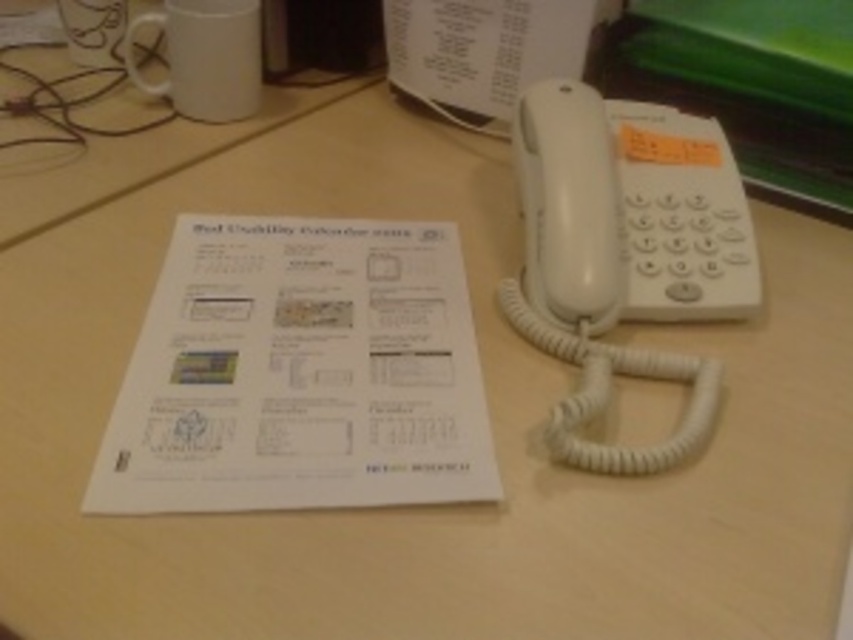
Can you confirm if white paper at center is thinner than white plastic phone at right?

No.

Between point (235, 438) and point (596, 172), which one is positioned in front?

Positioned in front is point (235, 438).

Find the location of `white paper at center`. white paper at center is located at coordinates (300, 372).